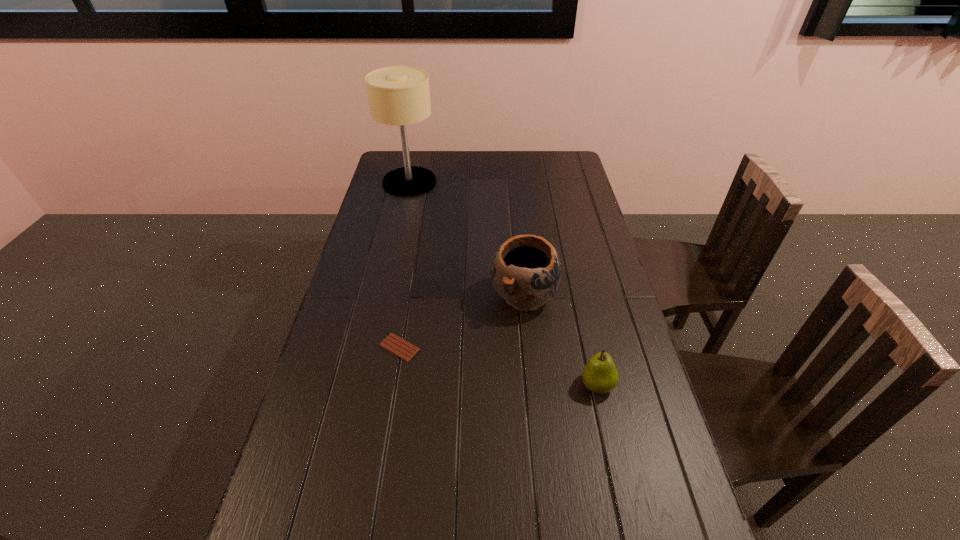
Image resolution: width=960 pixels, height=540 pixels. I want to click on blank space located on the left of the rightmost object, so click(526, 385).

Locate an element on the screen. free spot located 0.220m on the back of the shortest object is located at coordinates (411, 281).

This screenshot has width=960, height=540. I want to click on object that is at the far edge, so click(x=398, y=95).

The width and height of the screenshot is (960, 540). I want to click on table lamp present at the left edge, so click(x=398, y=95).

Locate an element on the screen. This screenshot has height=540, width=960. candy bar positioned at the left edge is located at coordinates (392, 343).

Find the location of a particular element. The width and height of the screenshot is (960, 540). object at the right edge is located at coordinates (599, 375).

I want to click on object that is at the far left corner, so click(x=398, y=95).

I want to click on vacant space at the far edge of the desktop, so click(445, 157).

You are a GUI agent. You are given a task and a screenshot of the screen. Output one action in this format:
    pyautogui.click(x=<x>, y=<y>)
    Task: Click on the free space at the left edge of the desktop
    
    Given the screenshot: What is the action you would take?
    [x=377, y=203]

This screenshot has height=540, width=960. I want to click on free region at the right edge of the desktop, so click(x=561, y=181).